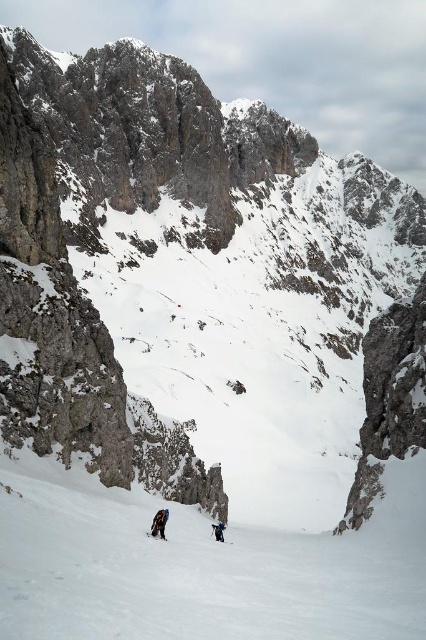
You are planning a ski trip and see the white snow ski slope at lower center and the matte black ski at lower center in the image. Which object is taller?

The white snow ski slope at lower center is much taller than the matte black ski at lower center.

You are a hiker planning to cross the snowfield in the foreground. You have a 1.2 meter long rope. Can you use it to reach from the dark gray fabric jacket at center to the matte black ski at lower center?

The distance between the dark gray fabric jacket at center and the matte black ski at lower center is 1.11 meters. Since your rope is 1.2 meters long, it is sufficient to span the gap between them.

You are planning a ski trip and see the white snow ski slope at lower center and the matte black ski at lower center in the image. Which object would be more suitable for a beginner skier to practice on, considering their sizes?

The white snow ski slope at lower center is larger in size compared to the matte black ski at lower center, making it more suitable for a beginner skier to practice on due to its greater space and stability.